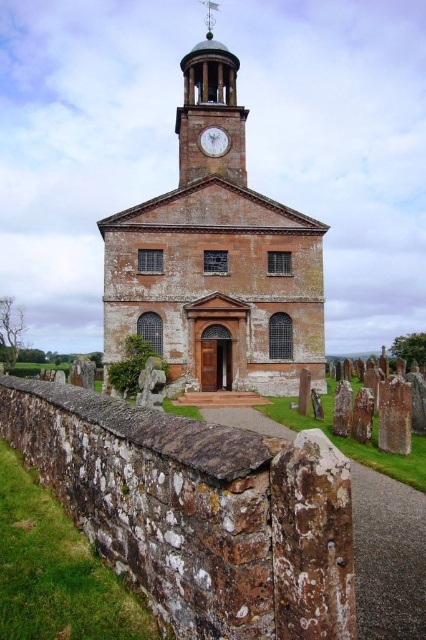
You are standing in front of the brown stone church at center and want to place a decorative wreath on the white glossy clock at upper center. Given that the church is significantly larger than the clock, can you estimate if the wreath will fit on the clock without being obscured by the church?

The brown stone church at center is larger than the white glossy clock at upper center, so the wreath placed on the clock may not be obscured by the church due to the clock being smaller in size but positioned higher up. However, the description does not provide information about the exact placement or distance between them, so visibility might depend on the actual positioning.

You are standing in front of the brown stone church at center and want to look at the white glossy clock at upper center. Which direction should you move your head to see it?

The brown stone church at center is located above the white glossy clock at upper center, so you should move your head downward to see it.

You are standing in front of the historic building complex. You want to take a photo that includes both the brown stone church at center and the light brown stone clock tower at upper center. Which one should you focus on to ensure both are fully visible in the frame?

Since the brown stone church at center is taller than the light brown stone clock tower at upper center, you should focus on the brown stone church at center to ensure both are fully visible in the frame.